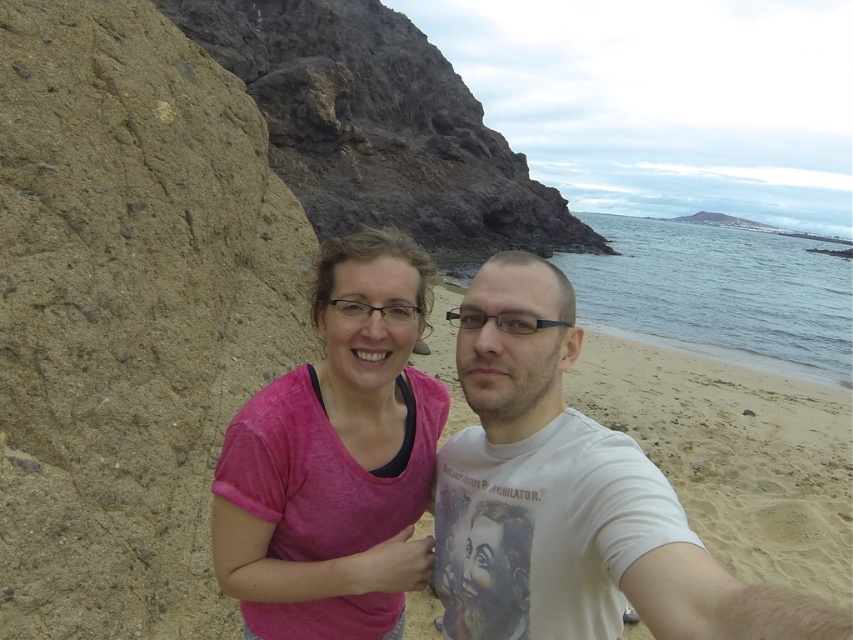
Question: Can you confirm if white cotton t-shirt at center is positioned to the right of pink fabric at center?

Choices:
 (A) yes
 (B) no

Answer: (A)

Question: Is pink fabric at center further to camera compared to brown rough rock at upper left?

Choices:
 (A) yes
 (B) no

Answer: (B)

Question: Among these objects, which one is nearest to the camera?

Choices:
 (A) brown rough rock at upper left
 (B) pink fabric at center

Answer: (B)

Question: Is pink fabric at center thinner than brown rough rock at upper left?

Choices:
 (A) no
 (B) yes

Answer: (B)

Question: Among these points, which one is nearest to the camera?

Choices:
 (A) (682, 596)
 (B) (351, 42)

Answer: (A)

Question: Which object is farther from the camera taking this photo?

Choices:
 (A) pink fabric at center
 (B) white cotton t-shirt at center

Answer: (A)